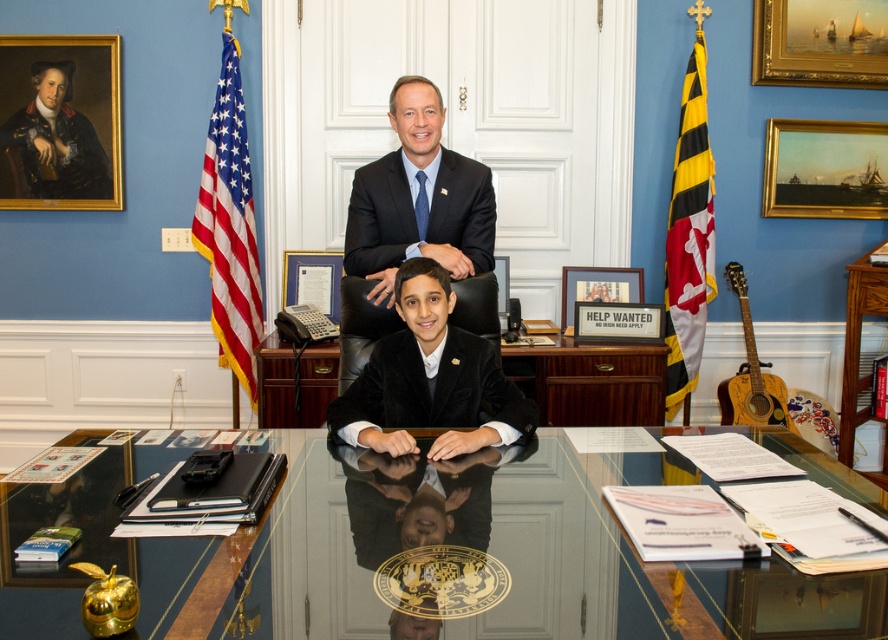
Does matte black suit at upper center have a lesser height compared to black velvet suit at center?

No, matte black suit at upper center is not shorter than black velvet suit at center.

Between matte black suit at upper center and black velvet suit at center, which one is positioned higher?

matte black suit at upper center is above.

This screenshot has width=888, height=640. In order to click on matte black suit at upper center in this screenshot , I will do `click(418, 198)`.

Does glossy glass table at center have a lesser width compared to matte black suit at upper center?

Incorrect, glossy glass table at center's width is not less than matte black suit at upper center's.

Is glossy glass table at center further to the viewer compared to matte black suit at upper center?

No, glossy glass table at center is in front of matte black suit at upper center.

Is point (778, 444) more distant than point (366, 234)?

No, (778, 444) is closer to viewer.

Find the location of a particular element. The width and height of the screenshot is (888, 640). glossy glass table at center is located at coordinates (401, 550).

Can you confirm if polyester american flag at left is thinner than oil painting ship at upper right?

Correct, polyester american flag at left's width is less than oil painting ship at upper right's.

Is point (242, 204) more distant than point (850, 214)?

No, (242, 204) is closer to viewer.

Does point (244, 330) lie behind point (814, 212)?

No.

Locate an element on the screen. The width and height of the screenshot is (888, 640). polyester american flag at left is located at coordinates (230, 227).